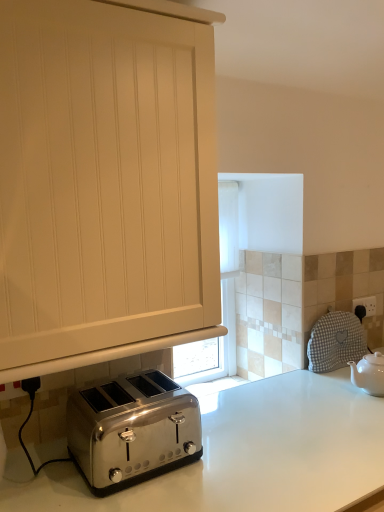
Question: In the image, is white glossy countertop at lower center on the left side or the right side of white wood cabinet at center?

Choices:
 (A) left
 (B) right

Answer: (B)

Question: From a real-world perspective, is white glossy countertop at lower center physically located above or below white wood cabinet at center?

Choices:
 (A) below
 (B) above

Answer: (A)

Question: Estimate the real-world distances between objects in this image. Which object is farther from the white wood cabinet at center?

Choices:
 (A) black plastic electric outlet at upper right
 (B) satin silver toaster at lower left
 (C) white ceramic teapot at right
 (D) white glossy countertop at lower center

Answer: (A)

Question: Which object is positioned closest to the white ceramic teapot at right?

Choices:
 (A) white glossy countertop at lower center
 (B) satin silver toaster at lower left
 (C) white wood cabinet at center
 (D) black plastic electric outlet at upper right

Answer: (D)